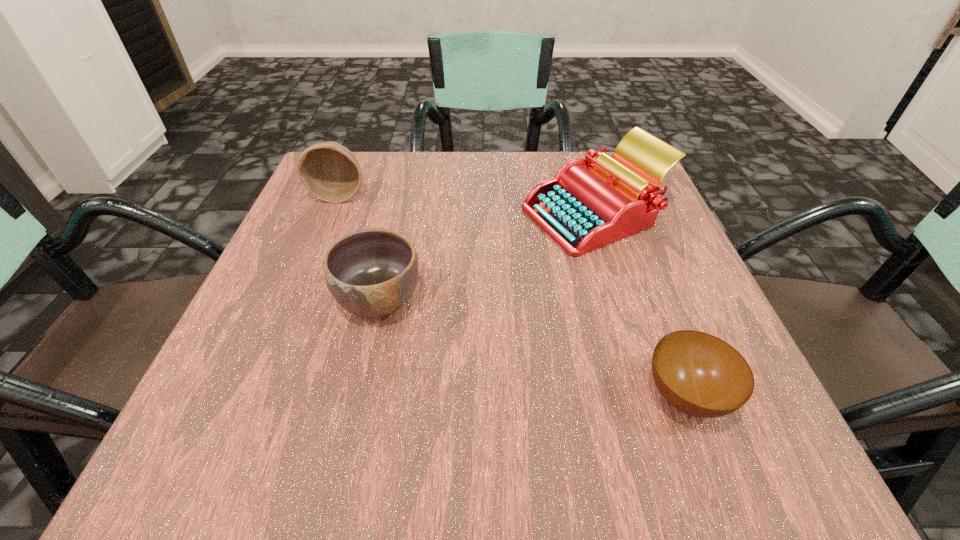
Where is `vacant area in the image that satisfies the following two spatial constraints: 1. on the typing side of the typewriter; 2. on the front side of the third farthest object`? The height and width of the screenshot is (540, 960). vacant area in the image that satisfies the following two spatial constraints: 1. on the typing side of the typewriter; 2. on the front side of the third farthest object is located at coordinates (621, 300).

This screenshot has height=540, width=960. I want to click on vacant area in the image that satisfies the following two spatial constraints: 1. on the front side of the second farthest bowl; 2. on the right side of the leftmost bowl, so click(x=297, y=300).

Find the location of a particular element. The image size is (960, 540). vacant space that satisfies the following two spatial constraints: 1. on the typing side of the rightmost bowl; 2. on the left side of the typewriter is located at coordinates (651, 396).